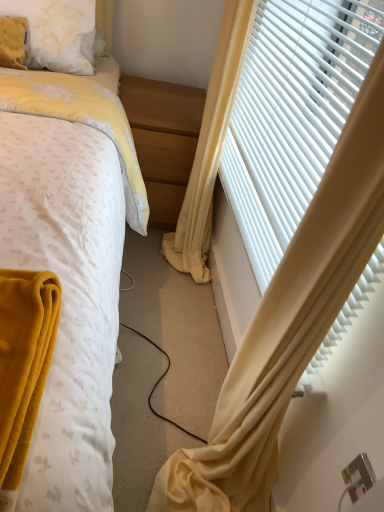
Question: From the image's perspective, does yellow fabric curtain at right, marked as the 1th curtain in a right-to-left arrangement, appear lower than silver metallic electric outlet at lower right?

Choices:
 (A) yes
 (B) no

Answer: (B)

Question: Could silver metallic electric outlet at lower right be considered to be inside yellow fabric curtain at right, the 2th curtain positioned from the left?

Choices:
 (A) no
 (B) yes

Answer: (A)

Question: Is yellow fabric curtain at right, the 2th curtain positioned from the left, further to the viewer compared to silver metallic electric outlet at lower right?

Choices:
 (A) no
 (B) yes

Answer: (B)

Question: Is yellow fabric curtain at right, marked as the 1th curtain in a right-to-left arrangement, outside silver metallic electric outlet at lower right?

Choices:
 (A) no
 (B) yes

Answer: (B)

Question: Does yellow fabric curtain at right, the 2th curtain positioned from the left, have a lesser height compared to silver metallic electric outlet at lower right?

Choices:
 (A) yes
 (B) no

Answer: (B)

Question: Considering the positions of light wood/finely finished nightstand at center and yellow fabric curtain at right, which is the second curtain from right to left, in the image, is light wood/finely finished nightstand at center taller or shorter than yellow fabric curtain at right, which is the second curtain from right to left,?

Choices:
 (A) tall
 (B) short

Answer: (B)

Question: Would you say light wood/finely finished nightstand at center is inside or outside yellow fabric curtain at right, the 1th curtain positioned from the left?

Choices:
 (A) outside
 (B) inside

Answer: (B)

Question: Is light wood/finely finished nightstand at center bigger or smaller than yellow fabric curtain at right, which is the second curtain from right to left?

Choices:
 (A) small
 (B) big

Answer: (A)

Question: From a real-world perspective, is light wood/finely finished nightstand at center positioned above or below yellow fabric curtain at right, which is the second curtain from right to left?

Choices:
 (A) below
 (B) above

Answer: (A)

Question: In terms of size, does fluffy white pillow at upper left appear bigger or smaller than yellow fabric curtain at right, the 1th curtain positioned from the left?

Choices:
 (A) small
 (B) big

Answer: (A)

Question: From the image's perspective, is fluffy white pillow at upper left above or below yellow fabric curtain at right, which is the second curtain from right to left?

Choices:
 (A) above
 (B) below

Answer: (A)

Question: Is fluffy white pillow at upper left situated inside yellow fabric curtain at right, the 1th curtain positioned from the left, or outside?

Choices:
 (A) inside
 (B) outside

Answer: (A)

Question: Considering the positions of point (56, 13) and point (317, 438), is point (56, 13) closer or farther from the camera than point (317, 438)?

Choices:
 (A) closer
 (B) farther

Answer: (B)

Question: Does point (33, 13) appear closer or farther from the camera than point (362, 9)?

Choices:
 (A) farther
 (B) closer

Answer: (A)

Question: Is fluffy white pillow at upper left inside the boundaries of white plastic blinds at right, or outside?

Choices:
 (A) outside
 (B) inside

Answer: (A)